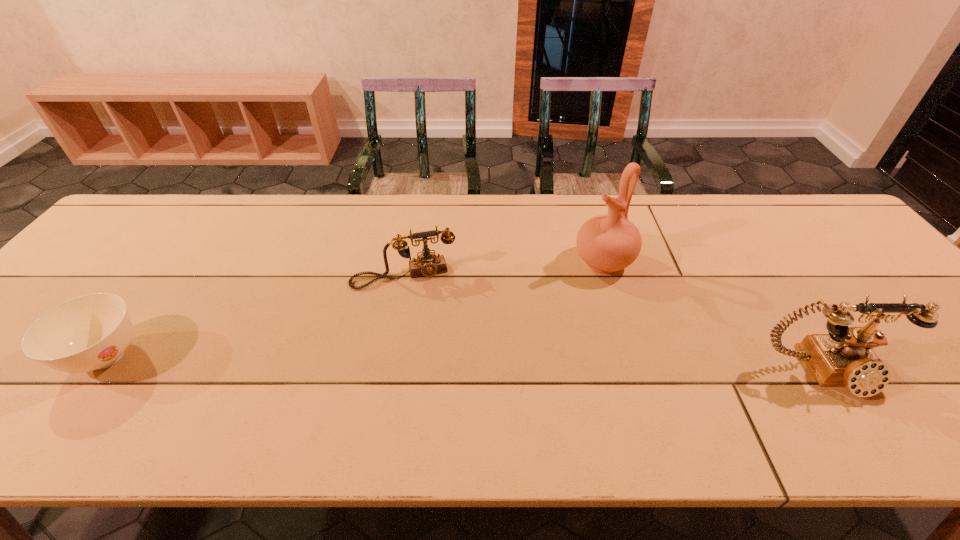
I want to click on vacant region at the near edge of the desktop, so click(327, 379).

The image size is (960, 540). I want to click on free space at the near left corner of the desktop, so click(27, 377).

In the image, there is a desktop. At what (x,y) coordinates should I click in order to perform the action: click on vacant space at the far right corner. Please return your answer as a coordinate pair (x, y). Looking at the image, I should click on (808, 231).

Locate an element on the screen. vacant space that's between the right telephone and the pottery is located at coordinates (714, 317).

You are a GUI agent. You are given a task and a screenshot of the screen. Output one action in this format:
    pyautogui.click(x=<x>, y=<y>)
    Task: Click on the free space between the tallest object and the shorter telephone
    Image resolution: width=960 pixels, height=540 pixels.
    Given the screenshot: What is the action you would take?
    pyautogui.click(x=504, y=269)

Identify the location of free space between the rightmost object and the third object from left to right. The width and height of the screenshot is (960, 540). (714, 317).

The image size is (960, 540). What are the coordinates of `free space that is in between the pottery and the second tallest object` in the screenshot? It's located at (714, 317).

The width and height of the screenshot is (960, 540). I want to click on empty space between the tallest object and the right telephone, so click(x=714, y=317).

You are a GUI agent. You are given a task and a screenshot of the screen. Output one action in this format:
    pyautogui.click(x=<x>, y=<y>)
    Task: Click on the free spot between the second object from left to right and the pottery
    The height and width of the screenshot is (540, 960).
    Given the screenshot: What is the action you would take?
    pyautogui.click(x=504, y=269)

This screenshot has width=960, height=540. I want to click on vacant area between the nearer telephone and the leftmost object, so click(466, 364).